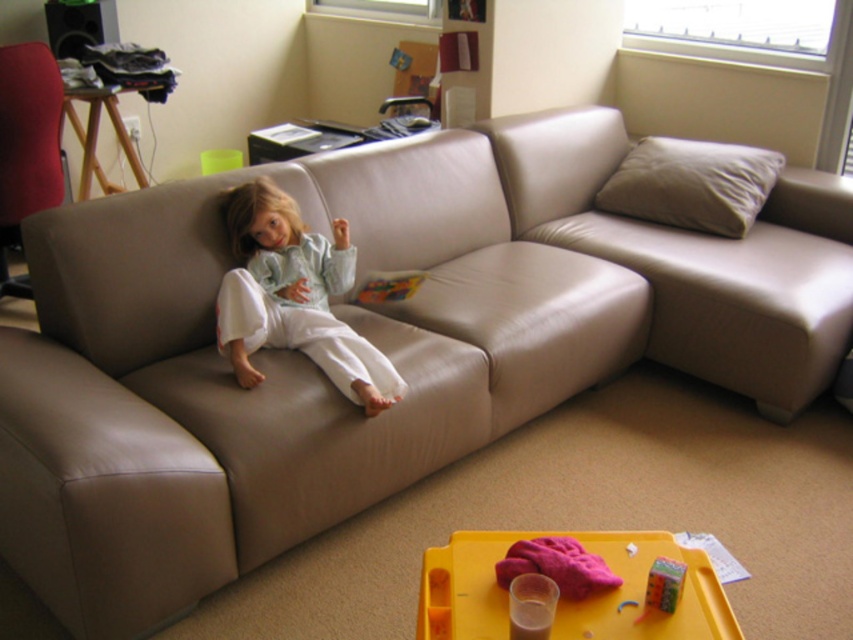
You are a delivery person trying to place a large package on the sofa. The package is the size of the leather couch at center. Can you place it on the sofa without overlapping the white cotton pants at center?

The leather couch at center is larger in size than white cotton pants at center. Since the package is the size of the leather couch at center, it would be too large to place on the sofa without overlapping the white cotton pants at center.

You are standing in the living room and want to sit on the leather couch at center. According to the coordinates provided, where exactly should you move to reach it?

The leather couch at center is located at coordinates point (695,259).